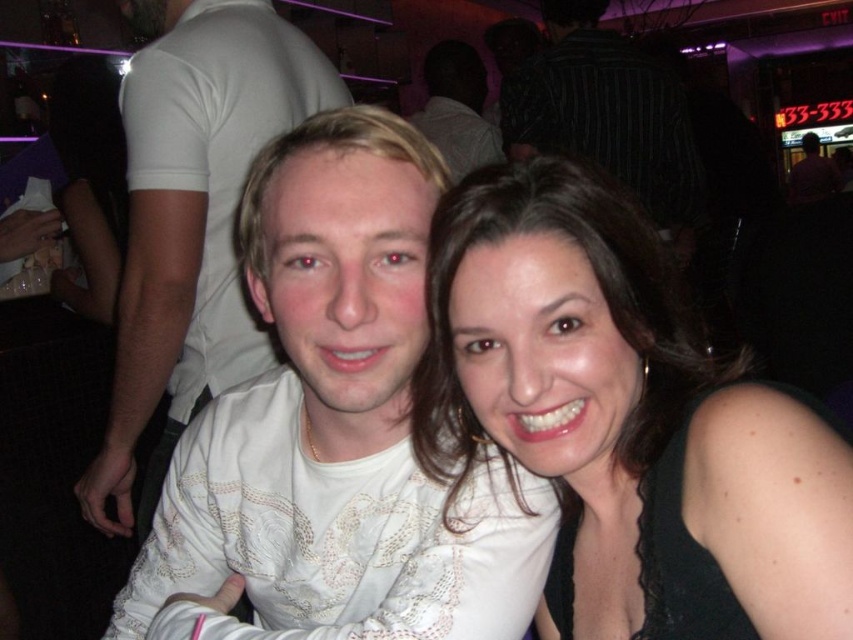
You are at a party and want to take a photo with both the white lace shirt at left and the white lace shirt at center in the frame. Since you can only move sideways, which direction should you move to ensure both shirts are visible?

You should move to the right to ensure both the white lace shirt at left and the white lace shirt at center are visible, as the white lace shirt at left is positioned to the left of the white lace shirt at center.

You are taking a photo of two people standing in a dimly lit indoor venue. You notice two points in the image labeled as point [334,356] and point [606,33]. Which of these points is nearer to the camera?

Point [334,356] is closer to the camera than point [606,33].

You are a photographer trying to focus on the white lace shirt at left. What are the coordinates where you should aim your camera?

The white lace shirt at left is located at coordinates point [192,216].